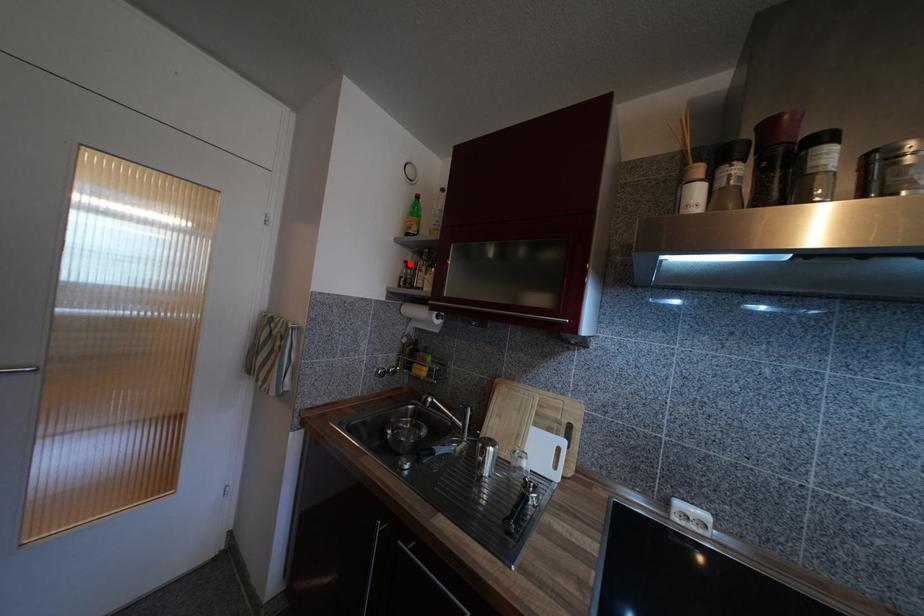
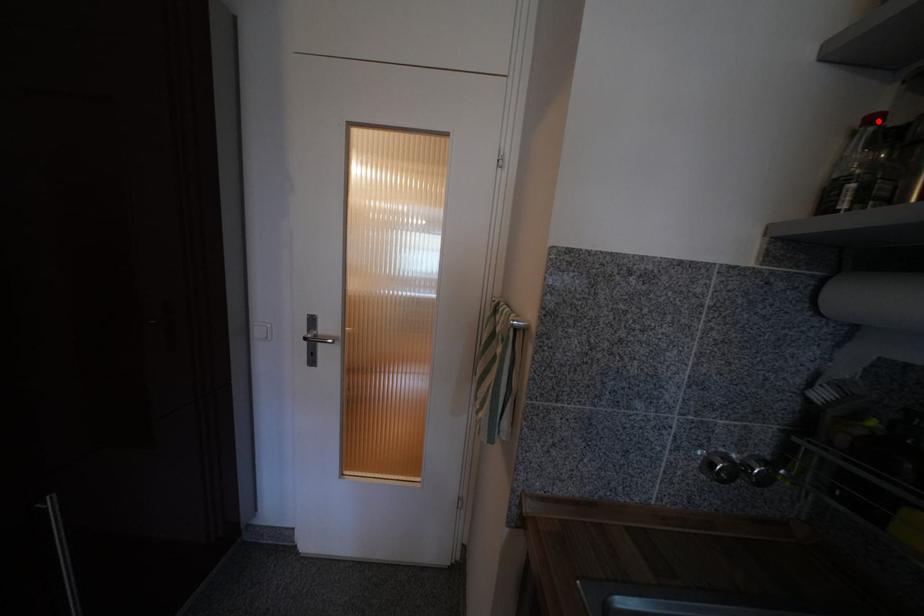
I am providing you with two images of the same scene from different viewpoints. A red point is marked on the first image and another point is marked on the second image. Is the red point in image1 aligned with the point shown in image2?

Yes